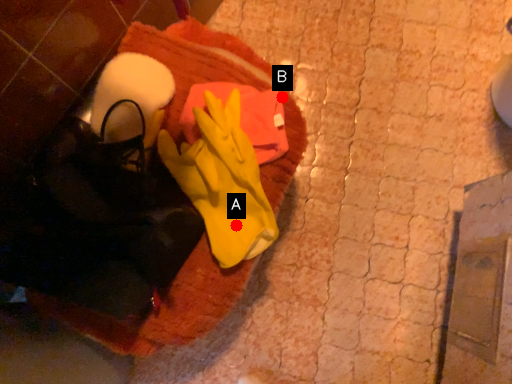
Question: Two points are circled on the image, labeled by A and B beside each circle. Which point appears closest to the camera in this image?

Choices:
 (A) A is closer
 (B) B is closer

Answer: (A)